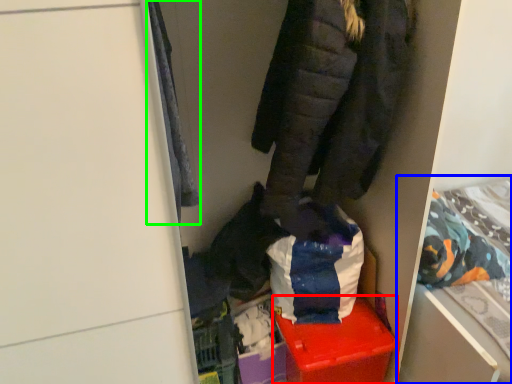
Question: Which object is the farthest from storage box (highlighted by a red box)? Choose among these: bed (highlighted by a blue box) or cloak (highlighted by a green box).

Choices:
 (A) bed
 (B) cloak

Answer: (B)